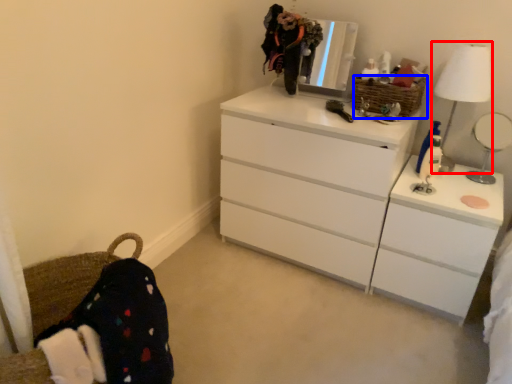
Question: Which object appears farthest to the camera in this image, table lamp (highlighted by a red box) or basket (highlighted by a blue box)?

Choices:
 (A) table lamp
 (B) basket

Answer: (B)